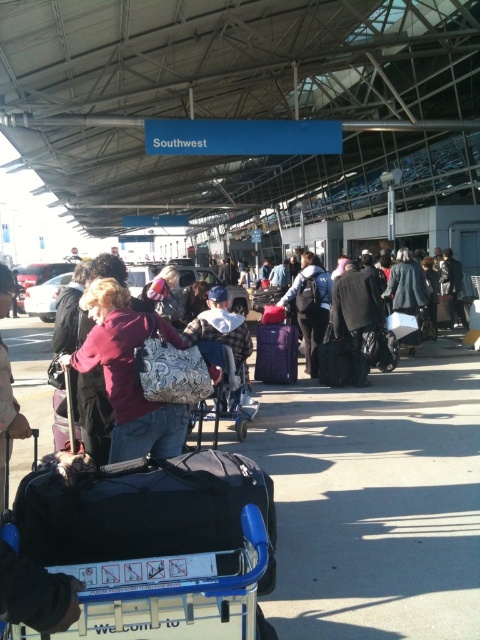
Question: From the image, what is the correct spatial relationship of matte maroon coat at center in relation to matte purple suitcase at center?

Choices:
 (A) below
 (B) above

Answer: (A)

Question: Based on their relative distances, which object is farther from the dark blue backpack at center?

Choices:
 (A) matte purple suitcase at center
 (B) matte maroon coat at center

Answer: (B)

Question: Does matte maroon coat at center appear under dark blue backpack at center?

Choices:
 (A) no
 (B) yes

Answer: (B)

Question: Among these objects, which one is nearest to the camera?

Choices:
 (A) matte purple suitcase at center
 (B) blue plastic cart at center

Answer: (B)

Question: Can you confirm if black fabric suitcase at center is wider than black fuzzy coat at center?

Choices:
 (A) no
 (B) yes

Answer: (B)

Question: Which object appears farthest from the camera in this image?

Choices:
 (A) matte maroon coat at center
 (B) black fuzzy coat at center
 (C) matte purple suitcase at center
 (D) blue plastic cart at center

Answer: (C)